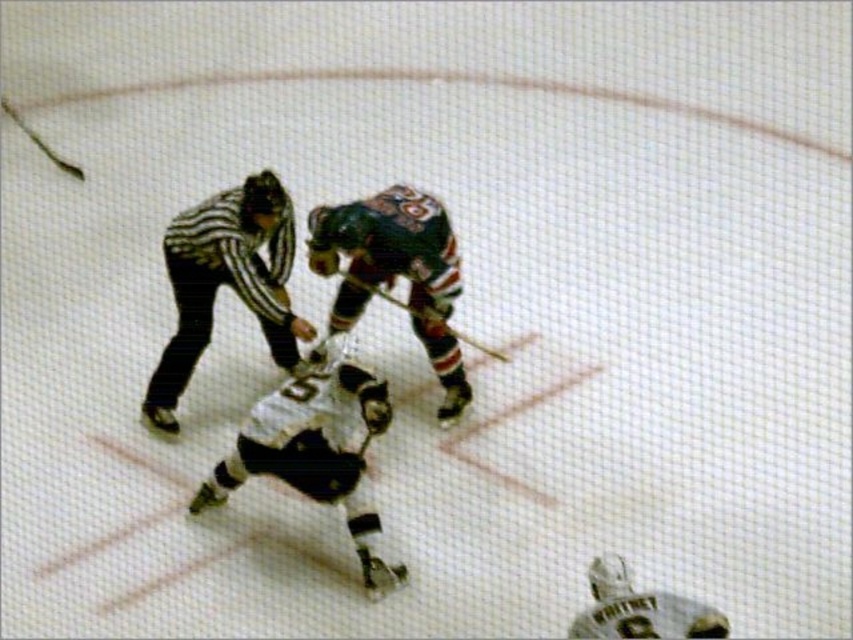
You are a referee standing at the edge of the ice rink. You need to determine if you can safely walk between the white matte hockey player at center and the white matte helmet at lower right without stepping onto the ice. The path between them is 3.96 feet wide. Your equipment requires at least 4 feet of clearance. Can you safely walk through this path?

The distance between the white matte hockey player at center and the white matte helmet at lower right is 3.96 feet, which is less than the required 4 feet of clearance. Therefore, you cannot safely walk through the path between them without stepping onto the ice.

You are a hockey player trying to pass the puck to your teammate. You are at point (280, 266) and your teammate is at point (438, 355). Based on the rink layout, will your pass travel forward towards the opponent goal or backward towards your own goal?

Point (280, 266) is behind point (438, 355), so passing to your teammate at (438, 355) would mean the puck is moving forward towards the opponent goal.

You are a spectator at the hockey game and want to take a photo of both the white matte hockey player at center and the striped jersey referee at center. Which one will appear smaller in your photo?

The white matte hockey player at center will appear smaller in the photo because it has a lesser height compared to the striped jersey referee at center.